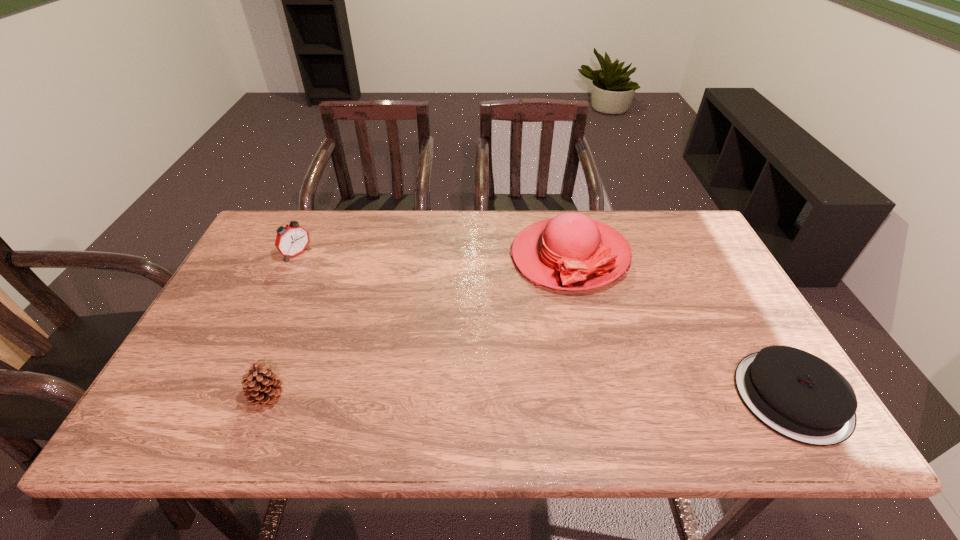
You are a GUI agent. You are given a task and a screenshot of the screen. Output one action in this format:
    pyautogui.click(x=<x>, y=<y>)
    Task: Click on the free space on the desktop that is between the pinecone and the shortest object and is positioned on the clock face of the leftmost object
    The width and height of the screenshot is (960, 540).
    Given the screenshot: What is the action you would take?
    pyautogui.click(x=467, y=397)

The width and height of the screenshot is (960, 540). I want to click on free space on the desktop that is between the pinecone and the pancake and is positioned at the front of the hat with a bow, so click(516, 397).